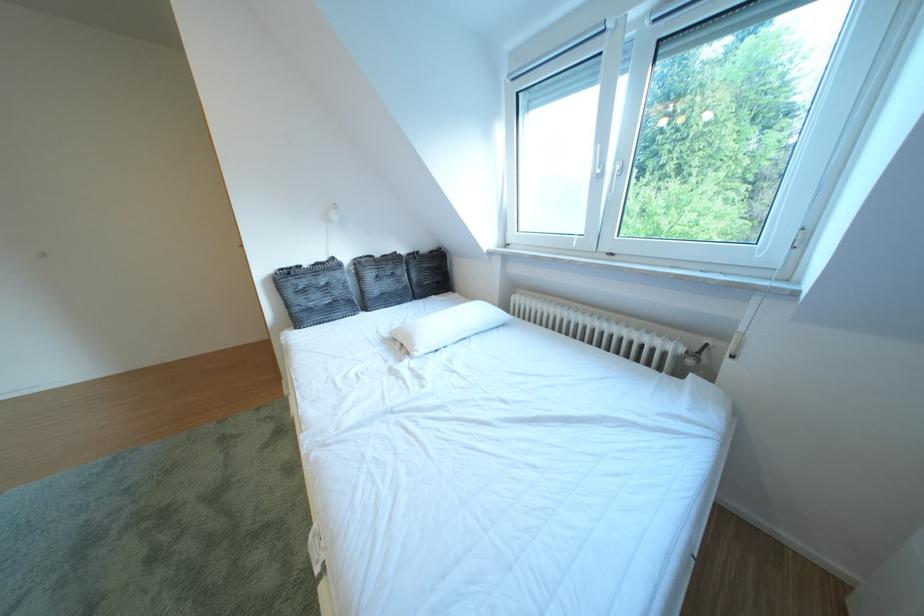
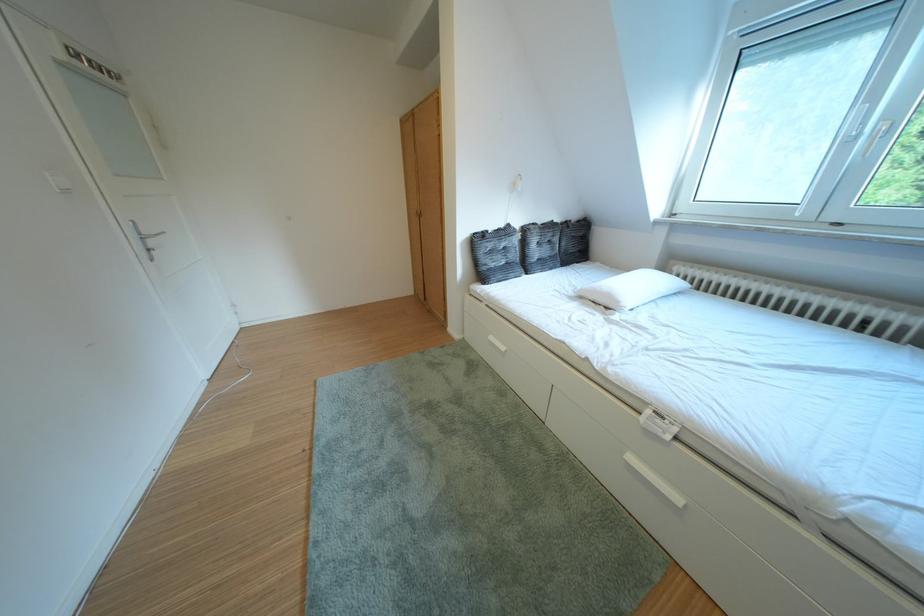
The images are taken continuously from a first-person perspective. In which direction are you moving?

The cameraman moved toward left, backward.